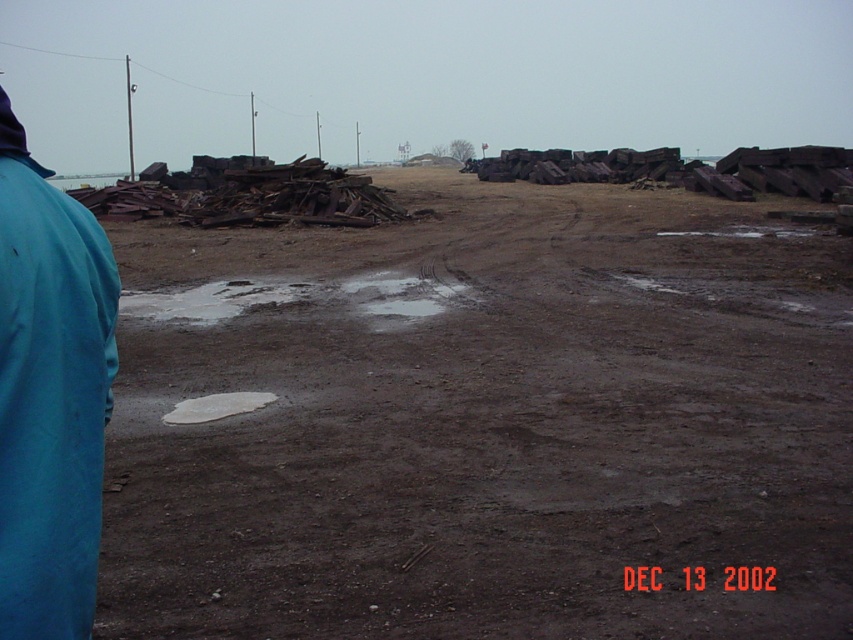
Between brown dirt field at center and white matte puddle at center, which one has more height?

With more height is brown dirt field at center.

Measure the distance between brown dirt field at center and white matte puddle at center.

brown dirt field at center and white matte puddle at center are 2.95 meters apart.

Is point (109, 502) positioned in front of point (198, 396)?

Yes, point (109, 502) is closer to viewer.

I want to click on brown dirt field at center, so click(485, 420).

Can you confirm if brown dirt field at center is bigger than rusty metal debris at center?

Yes.

Consider the image. Can you confirm if brown dirt field at center is smaller than rusty metal debris at center?

Actually, brown dirt field at center might be larger than rusty metal debris at center.

Between point (498, 230) and point (306, 192), which one is positioned behind?

Point (306, 192)

I want to click on brown dirt field at center, so click(485, 420).

Can you confirm if brown dirt field at center is positioned above blue fabric jacket at left?

Yes.

Between brown dirt field at center and blue fabric jacket at left, which one is positioned higher?

Positioned higher is brown dirt field at center.

Who is more distant from viewer, [531,452] or [44,376]?

The point [531,452] is behind.

This screenshot has height=640, width=853. Identify the location of brown dirt field at center. (485, 420).